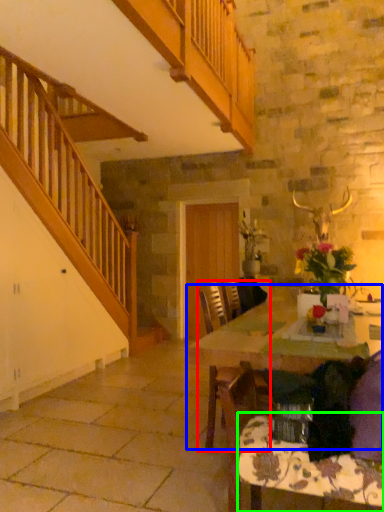
Question: Based on their relative distances, which object is nearer to chair (highlighted by a red box)? Choose from table (highlighted by a blue box) and tablecloth (highlighted by a green box).

Choices:
 (A) table
 (B) tablecloth

Answer: (A)